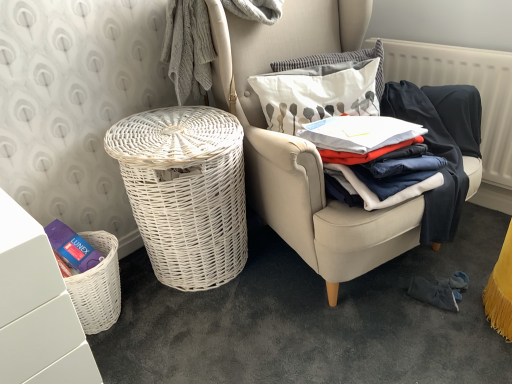
Question: In which direction should I rotate to look at white textured pillow at upper center, the 2th pillow ordered from the bottom?

Choices:
 (A) left
 (B) right

Answer: (B)

Question: From the image's perspective, does white textured pillow at upper center, the 2th pillow ordered from the bottom, appear higher than white fabric pillow at upper right, the second pillow in the top-to-bottom sequence?

Choices:
 (A) no
 (B) yes

Answer: (B)

Question: From a real-world perspective, does white textured pillow at upper center, the 2th pillow ordered from the bottom, sit lower than white fabric pillow at upper right, the 1th pillow ordered from the bottom?

Choices:
 (A) no
 (B) yes

Answer: (A)

Question: Is white textured pillow at upper center, the 2th pillow ordered from the bottom, aimed at white fabric pillow at upper right, the 1th pillow ordered from the bottom?

Choices:
 (A) yes
 (B) no

Answer: (A)

Question: Does white textured pillow at upper center, arranged as the first pillow when viewed from the top, appear on the left side of white fabric pillow at upper right, the 1th pillow ordered from the bottom?

Choices:
 (A) no
 (B) yes

Answer: (A)

Question: Is white fabric pillow at upper right, the 1th pillow ordered from the bottom, at the back of white textured pillow at upper center, the 2th pillow ordered from the bottom?

Choices:
 (A) yes
 (B) no

Answer: (B)

Question: Does white textured pillow at upper center, arranged as the first pillow when viewed from the top, have a larger size compared to white fabric pillow at upper right, the second pillow in the top-to-bottom sequence?

Choices:
 (A) no
 (B) yes

Answer: (A)

Question: From the image's perspective, is white wicker chair at center on top of white matte vanity at lower left?

Choices:
 (A) no
 (B) yes

Answer: (B)

Question: Does white wicker chair at center have a lesser height compared to white matte vanity at lower left?

Choices:
 (A) no
 (B) yes

Answer: (A)

Question: Is white wicker chair at center thinner than white matte vanity at lower left?

Choices:
 (A) no
 (B) yes

Answer: (A)

Question: From a real-world perspective, is white wicker chair at center on white matte vanity at lower left?

Choices:
 (A) no
 (B) yes

Answer: (B)

Question: Is white wicker chair at center looking in the opposite direction of white matte vanity at lower left?

Choices:
 (A) yes
 (B) no

Answer: (B)

Question: From the image's perspective, does white wicker chair at center appear lower than white matte vanity at lower left?

Choices:
 (A) no
 (B) yes

Answer: (A)

Question: Is white textured radiator at upper right turned away from white wicker chair at center?

Choices:
 (A) no
 (B) yes

Answer: (A)